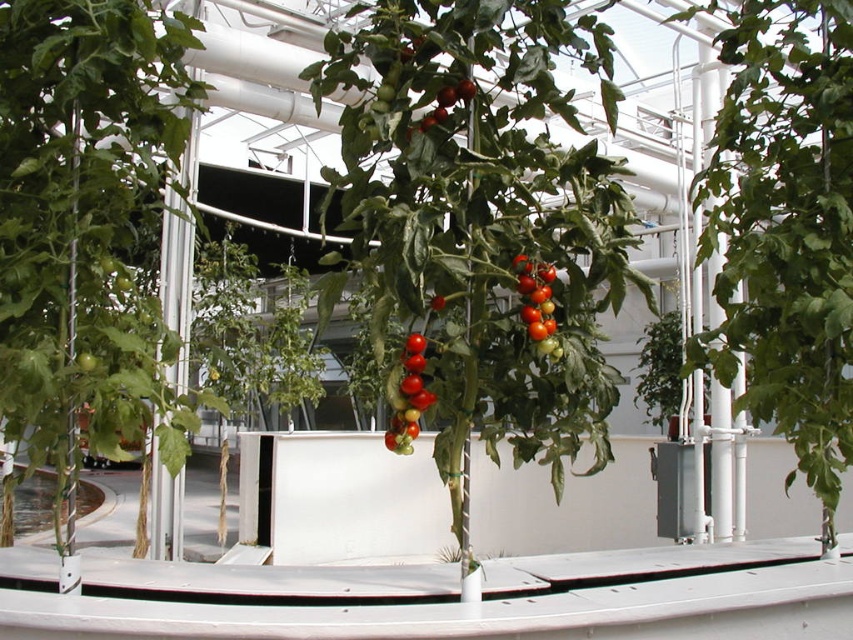
Which is below, glossy red tomatoes at center or shiny red tomato at center?

glossy red tomatoes at center is lower down.

Who is more forward, (405, 358) or (537, 285)?

Point (405, 358)

Find the location of `glossy red tomatoes at center`. glossy red tomatoes at center is located at coordinates (409, 396).

Where is `glossy red tomatoes at center`? The width and height of the screenshot is (853, 640). glossy red tomatoes at center is located at coordinates (409, 396).

Is point (724, 193) positioned after point (552, 333)?

That is True.

Is point (786, 97) closer to camera compared to point (527, 310)?

No, (786, 97) is further to viewer.

In order to click on green matte leafy plant at center in this screenshot , I will do `click(784, 228)`.

Can you confirm if green matte plant at center is thinner than shiny red tomato at center?

Incorrect, green matte plant at center's width is not less than shiny red tomato at center's.

Locate an element on the screen. The width and height of the screenshot is (853, 640). green matte plant at center is located at coordinates (660, 371).

Between point (676, 390) and point (554, 324), which one is positioned behind?

The point (676, 390) is behind.

Where is `green matte plant at center`? green matte plant at center is located at coordinates (660, 371).